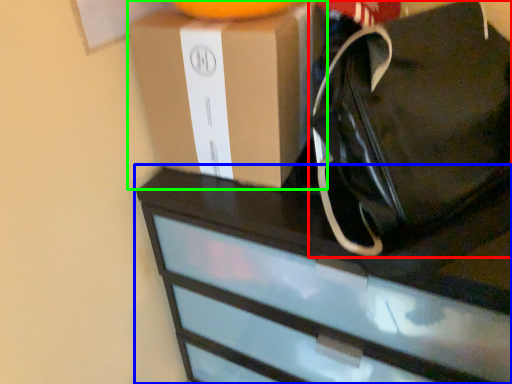
Question: Which is farther away from tote bag (highlighted by a red box)? chest of drawers (highlighted by a blue box) or box (highlighted by a green box)?

Choices:
 (A) chest of drawers
 (B) box

Answer: (A)